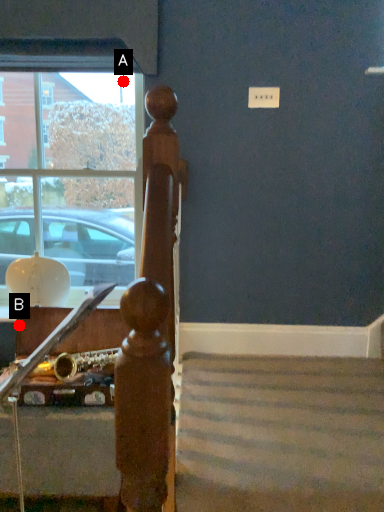
Question: Two points are circled on the image, labeled by A and B beside each circle. Among these points, which one is farthest from the camera?

Choices:
 (A) A is further
 (B) B is further

Answer: (A)